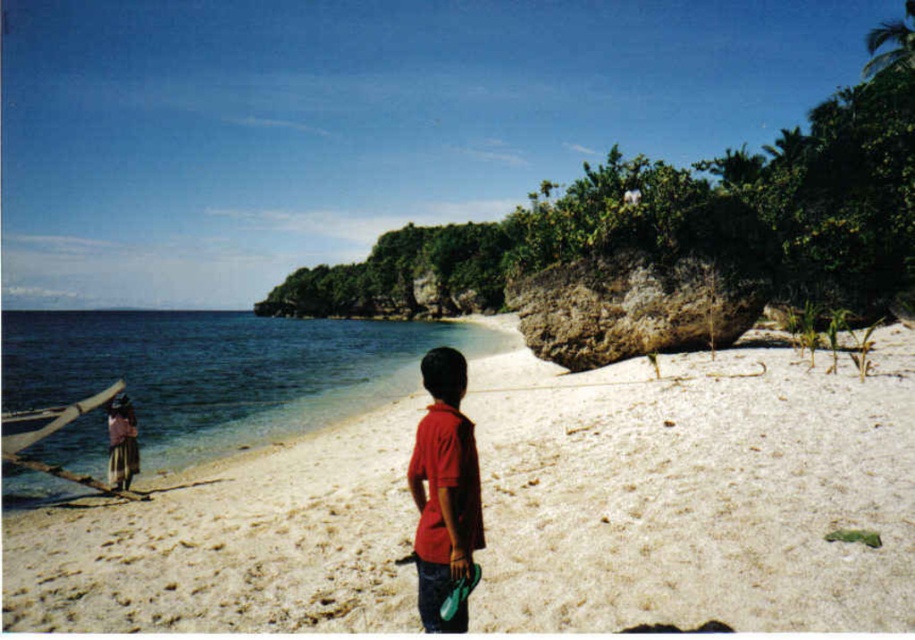
You are a photographer standing at the center of the beach scene. You want to take a photo that includes both the clear blue water at lower left and the brown woven fabric at left. Given that your camera has a maximum zoom range of 100 meters, will you be able to capture both objects in a single frame without moving your position?

The clear blue water at lower left is 95.49 meters away from the brown woven fabric at left. Since the maximum zoom range of the camera is 100 meters, the distance between them is within the camera capabilities. Therefore, you can capture both objects in a single frame without moving.

You are standing on the white sandy beach at center and want to reach the clear blue water at lower left. Which direction should you walk to get to the water?

You should walk towards the lower left direction to reach the clear blue water at lower left since the white sandy beach at center is in front of it.